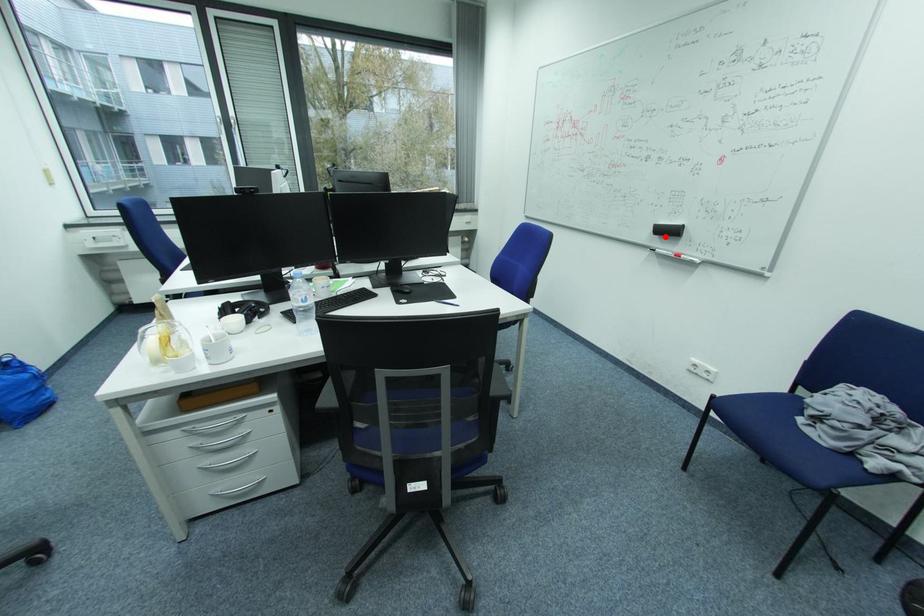
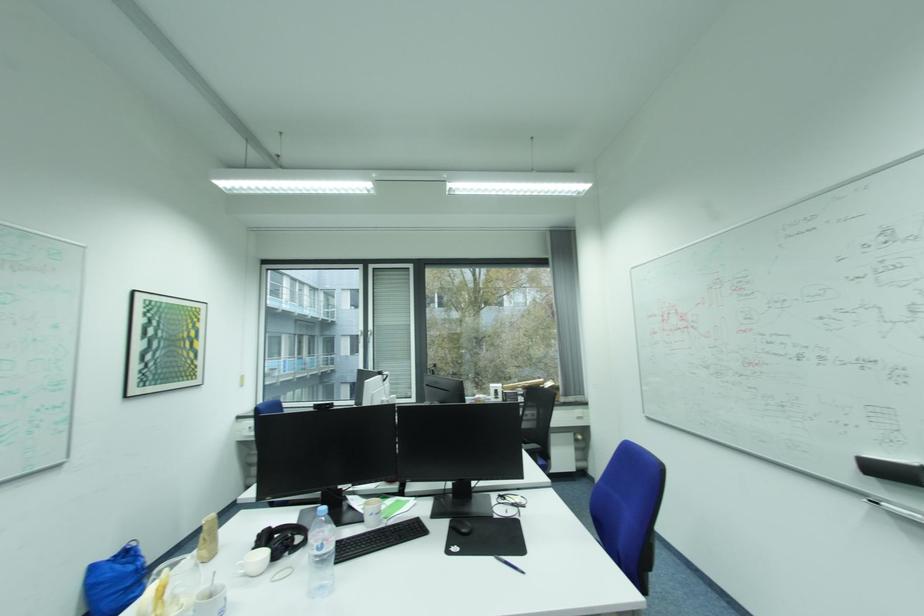
Question: I am providing you with two images of the same scene from different viewpoints. A red point is marked on the first image. Can you still see the location of the red point in image 2?

Choices:
 (A) Yes
 (B) No

Answer: (A)